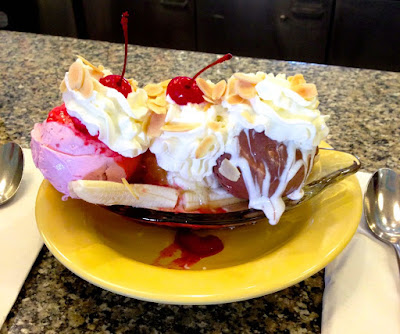
At what (x,y) coordinates should I click in order to perform the action: click on yellow plate. Please return your answer as a coordinate pair (x, y). Looking at the image, I should click on (277, 265).